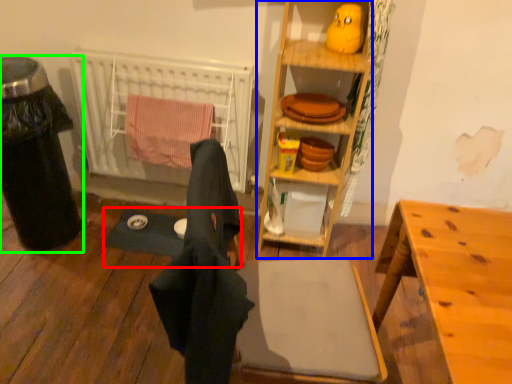
Question: Estimate the real-world distances between objects in this image. Which object is farther from yoga mat (highlighted by a red box), cabinetry (highlighted by a blue box) or trash bin/can (highlighted by a green box)?

Choices:
 (A) cabinetry
 (B) trash bin/can

Answer: (A)